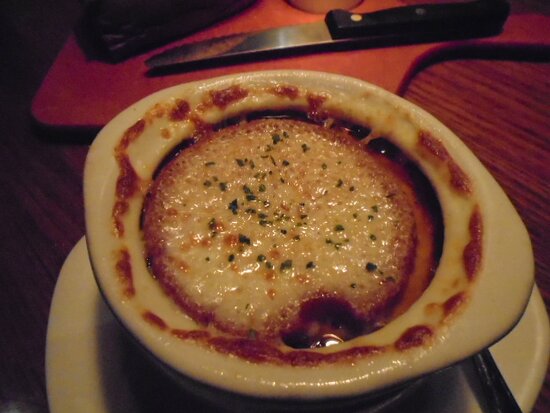
In order to click on spoon in this screenshot , I will do `click(481, 384)`.